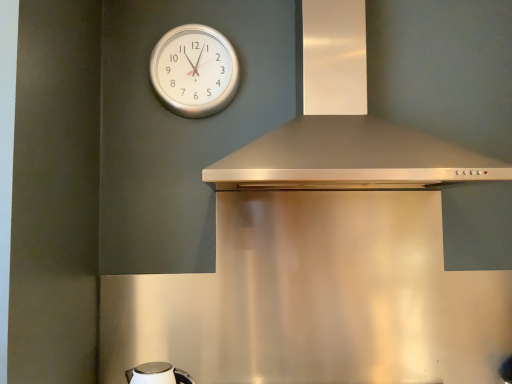
Question: Is silver metallic clock at upper center taller than white glossy kettle at lower left?

Choices:
 (A) yes
 (B) no

Answer: (A)

Question: Is silver metallic clock at upper center placed right next to white glossy kettle at lower left?

Choices:
 (A) yes
 (B) no

Answer: (B)

Question: Can you confirm if silver metallic clock at upper center is shorter than white glossy kettle at lower left?

Choices:
 (A) yes
 (B) no

Answer: (B)

Question: Is silver metallic clock at upper center located outside white glossy kettle at lower left?

Choices:
 (A) no
 (B) yes

Answer: (B)

Question: Is white glossy kettle at lower left completely or partially inside silver metallic clock at upper center?

Choices:
 (A) no
 (B) yes

Answer: (A)

Question: From the image's perspective, is satin silver vent at upper center positioned above or below silver metallic clock at upper center?

Choices:
 (A) below
 (B) above

Answer: (A)

Question: Relative to silver metallic clock at upper center, is satin silver vent at upper center in front or behind?

Choices:
 (A) behind
 (B) front

Answer: (B)

Question: Is satin silver vent at upper center to the left or to the right of silver metallic clock at upper center in the image?

Choices:
 (A) left
 (B) right

Answer: (B)

Question: Based on their sizes in the image, would you say satin silver vent at upper center is bigger or smaller than silver metallic clock at upper center?

Choices:
 (A) small
 (B) big

Answer: (B)

Question: In terms of width, does satin silver vent at upper center look wider or thinner when compared to white glossy kettle at lower left?

Choices:
 (A) thin
 (B) wide

Answer: (B)

Question: From the image's perspective, is satin silver vent at upper center located above or below white glossy kettle at lower left?

Choices:
 (A) above
 (B) below

Answer: (A)

Question: In the image, is satin silver vent at upper center on the left side or the right side of white glossy kettle at lower left?

Choices:
 (A) right
 (B) left

Answer: (A)

Question: Considering the positions of satin silver vent at upper center and white glossy kettle at lower left in the image, is satin silver vent at upper center bigger or smaller than white glossy kettle at lower left?

Choices:
 (A) small
 (B) big

Answer: (B)

Question: From a real-world perspective, is white glossy kettle at lower left positioned above or below satin silver vent at upper center?

Choices:
 (A) below
 (B) above

Answer: (A)

Question: Considering the positions of white glossy kettle at lower left and satin silver vent at upper center in the image, is white glossy kettle at lower left taller or shorter than satin silver vent at upper center?

Choices:
 (A) short
 (B) tall

Answer: (A)